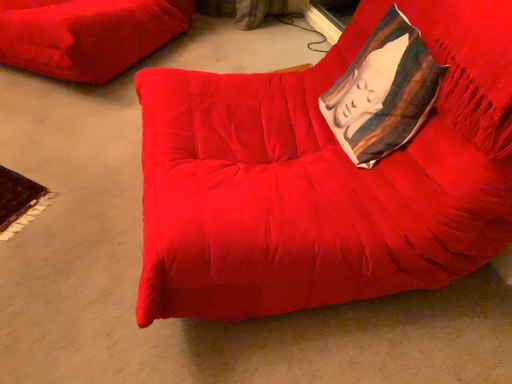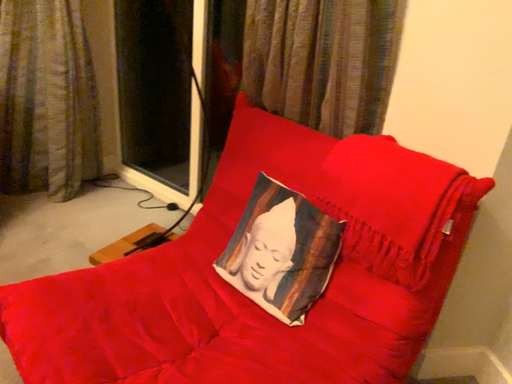
Question: Which way did the camera rotate in the video?

Choices:
 (A) rotated left
 (B) rotated right

Answer: (B)